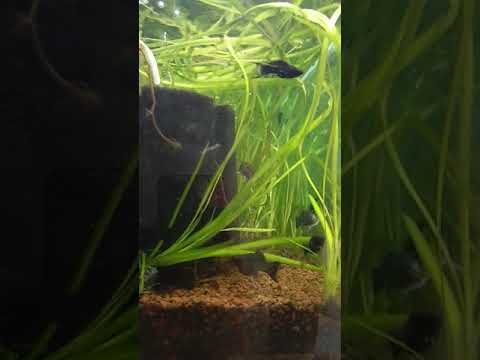
What are the coordinates of `glass` in the screenshot? It's located at (173, 128).